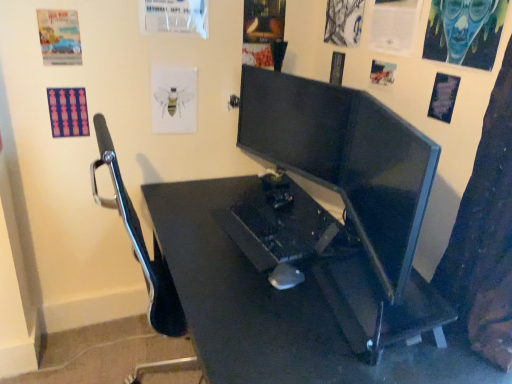
The width and height of the screenshot is (512, 384). I want to click on free space above black plastic desk at center (from a real-world perspective), so click(288, 266).